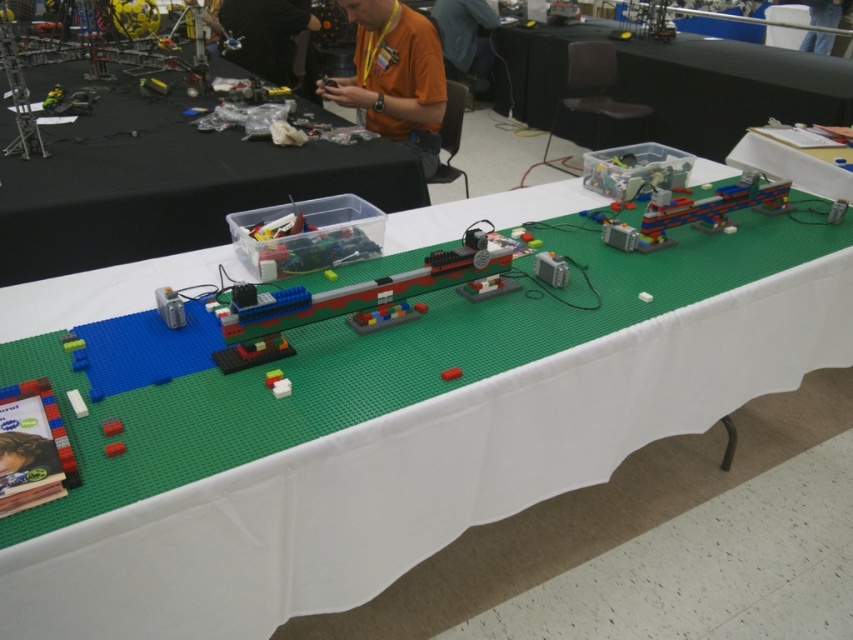
Can you confirm if orange shirt at center is positioned to the right of orange shirt at upper center?

No, orange shirt at center is not to the right of orange shirt at upper center.

Is point (340, 81) farther from camera compared to point (463, 1)?

No, it is not.

Which is behind, point (395, 44) or point (442, 20)?

Positioned behind is point (442, 20).

The image size is (853, 640). What are the coordinates of `orange shirt at center` in the screenshot? It's located at (393, 76).

Does point (247, 177) come closer to viewer compared to point (825, 24)?

Yes.

Is green plastic table at center wider than denim pants at upper right?

Correct, the width of green plastic table at center exceeds that of denim pants at upper right.

You are a GUI agent. You are given a task and a screenshot of the screen. Output one action in this format:
    pyautogui.click(x=<x>, y=<y>)
    Task: Click on the green plastic table at center
    The image size is (853, 640).
    Given the screenshot: What is the action you would take?
    pyautogui.click(x=163, y=182)

Which is below, black fabric pants at upper center or denim pants at upper right?

Positioned lower is black fabric pants at upper center.

Who is more distant from viewer, (293, 17) or (850, 1)?

The point (850, 1) is more distant.

Image resolution: width=853 pixels, height=640 pixels. I want to click on black fabric pants at upper center, so click(264, 35).